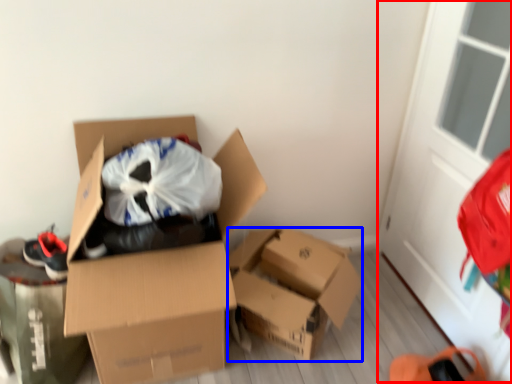
Question: Which of the following is the farthest to the observer, screen door (highlighted by a red box) or box (highlighted by a blue box)?

Choices:
 (A) screen door
 (B) box

Answer: (B)